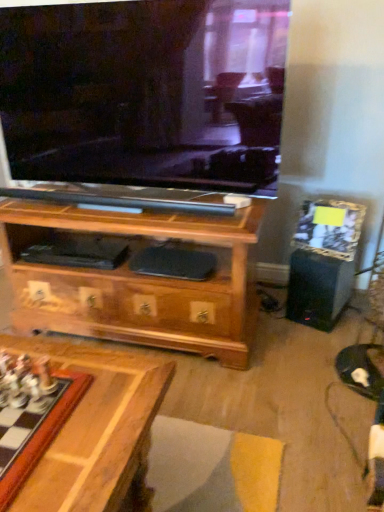
Question: Is black plastic speaker at right in front of or behind wooden chessboard at lower left in the image?

Choices:
 (A) front
 (B) behind

Answer: (B)

Question: Is point (337, 276) positioned closer to the camera than point (9, 409)?

Choices:
 (A) farther
 (B) closer

Answer: (A)

Question: From the image's perspective, relative to wooden chessboard at lower left, is black plastic speaker at right above or below?

Choices:
 (A) below
 (B) above

Answer: (B)

Question: Choose the correct answer: Is wooden chessboard at lower left inside black plastic speaker at right or outside it?

Choices:
 (A) outside
 (B) inside

Answer: (A)

Question: Is point (31, 441) positioned closer to the camera than point (311, 273)?

Choices:
 (A) closer
 (B) farther

Answer: (A)

Question: Considering the positions of wooden chessboard at lower left and black plastic speaker at right in the image, is wooden chessboard at lower left bigger or smaller than black plastic speaker at right?

Choices:
 (A) big
 (B) small

Answer: (B)

Question: From the image's perspective, is wooden chessboard at lower left above or below black plastic speaker at right?

Choices:
 (A) below
 (B) above

Answer: (A)